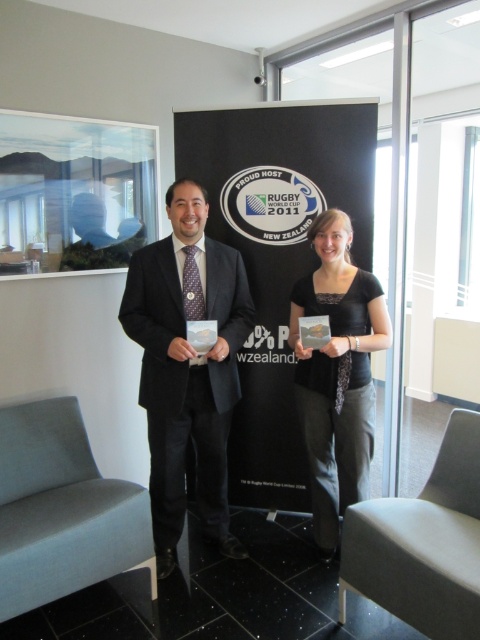
Question: Which point is closer to the camera?

Choices:
 (A) black textured shirt at center
 (B) black suit at center

Answer: (B)

Question: Is black suit at center to the left of black textured shirt at center from the viewer's perspective?

Choices:
 (A) yes
 (B) no

Answer: (A)

Question: Which point is closer to the camera?

Choices:
 (A) (324, 301)
 (B) (163, 461)

Answer: (A)

Question: Does black suit at center have a larger size compared to black textured shirt at center?

Choices:
 (A) no
 (B) yes

Answer: (B)

Question: Does black suit at center appear on the right side of black textured shirt at center?

Choices:
 (A) yes
 (B) no

Answer: (B)

Question: Among these objects, which one is farthest from the camera?

Choices:
 (A) black textured shirt at center
 (B) black suit at center

Answer: (A)